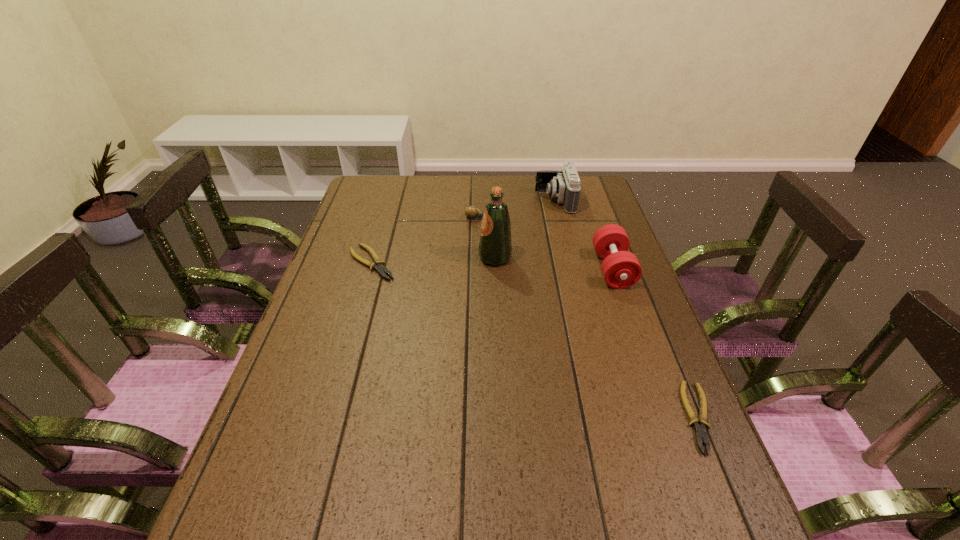
Find the location of a particular element. The width and height of the screenshot is (960, 540). free space between the third object from right to left and the nearest object is located at coordinates (627, 309).

Locate an element on the screen. This screenshot has height=540, width=960. empty space that is in between the camera and the second shortest object is located at coordinates (464, 232).

Locate which object ranks in proximity to the fourth shortest object. Please provide its 2D coordinates. Your answer should be formatted as a tuple, i.e. [(x, y)], where the tuple contains the x and y coordinates of a point satisfying the conditions above.

[(564, 185)]

You are a GUI agent. You are given a task and a screenshot of the screen. Output one action in this format:
    pyautogui.click(x=<x>, y=<y>)
    Task: Click on the object that ranks as the closest to the fourth tallest object
    The height and width of the screenshot is (540, 960).
    Given the screenshot: What is the action you would take?
    pyautogui.click(x=495, y=248)

Locate an element on the screen. free space that satisfies the following two spatial constraints: 1. on the front-facing side of the dumbbell; 2. on the left side of the fourth tallest object is located at coordinates (478, 269).

Locate an element on the screen. The image size is (960, 540). vacant region that satisfies the following two spatial constraints: 1. on the front-facing side of the escargot; 2. on the left side of the nearest object is located at coordinates (478, 417).

What are the coordinates of `free space that satisfies the following two spatial constraints: 1. on the front-facing side of the shorter pliers; 2. on the right side of the escargot` in the screenshot? It's located at (478, 417).

The height and width of the screenshot is (540, 960). In order to click on free space that satisfies the following two spatial constraints: 1. on the back side of the third tallest object; 2. on the front-facing side of the escargot in this screenshot , I will do `click(594, 218)`.

Locate an element on the screen. Image resolution: width=960 pixels, height=540 pixels. vacant point that satisfies the following two spatial constraints: 1. at the front of the third object from right to left with an open lens cover; 2. on the front side of the leftmost object is located at coordinates (570, 263).